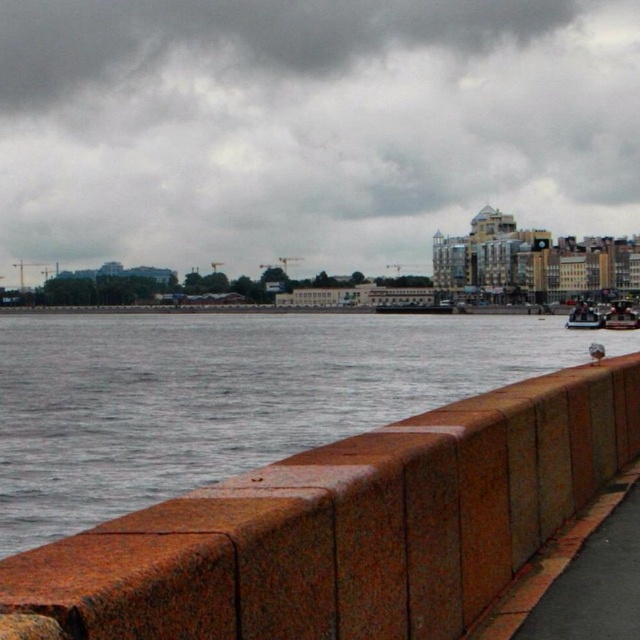
You are standing at the center of the image and want to walk towards the rustic stone barrier at lower center. Which direction should you move?

You should move downward and to the right to reach the rustic stone barrier at lower center since it is located at point [349,525].

Based on the photo, you are standing at the point closer to the viewer between the two points, point (474, 573) and point (589, 323). Which point are you standing at?

You are standing at point (474, 573) because it is in front of point (589, 323).

You are planning to transport a large sculpture that requires a vessel longer than 10 meters. Looking at the wooden polished boat at right and the metallic silver boat at lower right, which one would be suitable for your sculpture?

The metallic silver boat at lower right is longer than the wooden polished boat at right, so it would be suitable for transporting the large sculpture requiring a vessel longer than 10 meters.